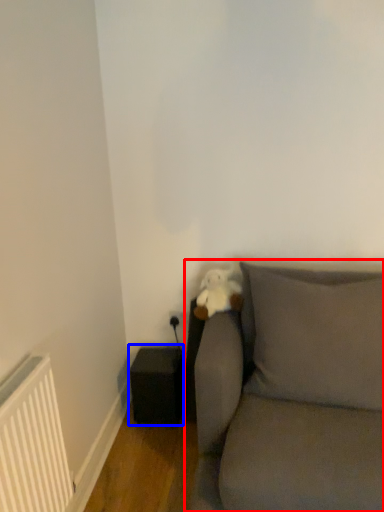
Question: Which object is closer to the camera taking this photo, studio couch (highlighted by a red box) or speaker (highlighted by a blue box)?

Choices:
 (A) studio couch
 (B) speaker

Answer: (A)